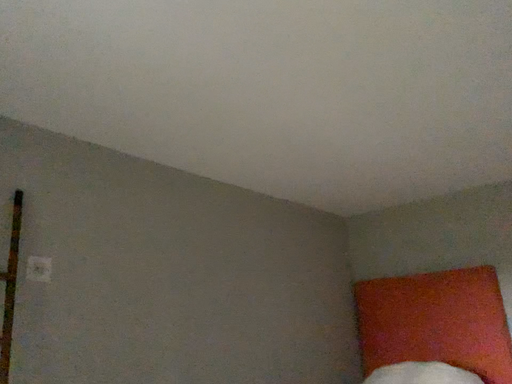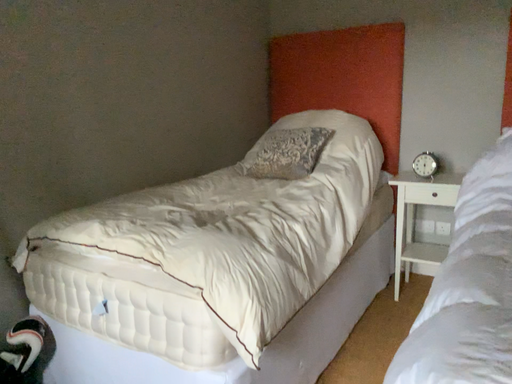
Question: Which way did the camera rotate in the video?

Choices:
 (A) rotated upward
 (B) rotated downward

Answer: (B)